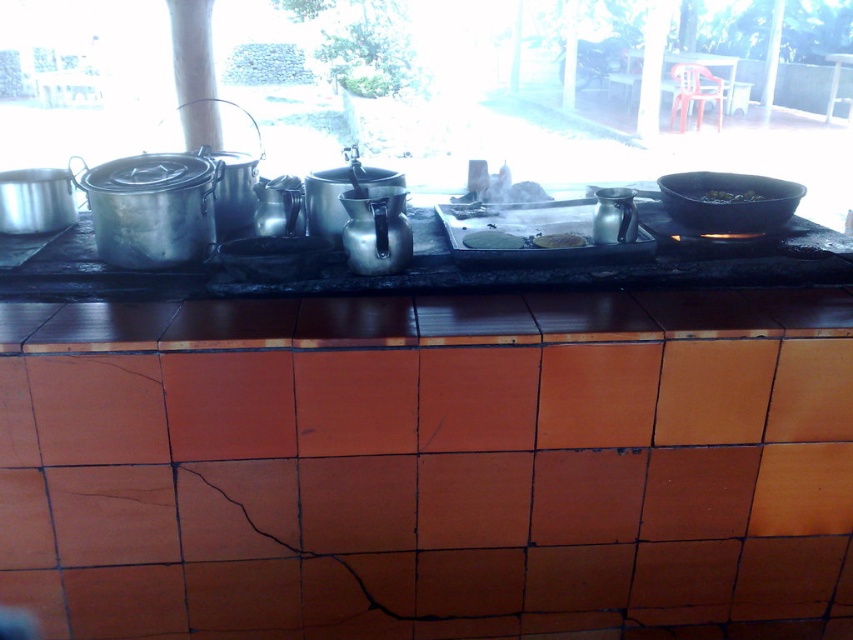
Question: Estimate the real-world distances between objects in this image. Which object is farther from the metallic/reflective counter at center?

Choices:
 (A) black matte frying pan at right
 (B) yellow matte flatbread at center

Answer: (A)

Question: Can you confirm if black matte pan at upper right is positioned to the right of yellow matte flatbread at center?

Choices:
 (A) no
 (B) yes

Answer: (B)

Question: Which point is farther to the camera?

Choices:
 (A) yellow matte flatbread at center
 (B) metallic/reflective counter at center
 (C) black matte pan at upper right

Answer: (C)

Question: Which of the following is the farthest from the observer?

Choices:
 (A) black matte pan at upper right
 (B) metallic/reflective counter at center
 (C) black matte frying pan at right
 (D) yellow matte flatbread at center

Answer: (A)

Question: Is metallic/reflective counter at center thinner than black matte frying pan at right?

Choices:
 (A) no
 (B) yes

Answer: (A)

Question: Where is metallic/reflective counter at center located in relation to black matte pan at upper right in the image?

Choices:
 (A) left
 (B) right

Answer: (A)